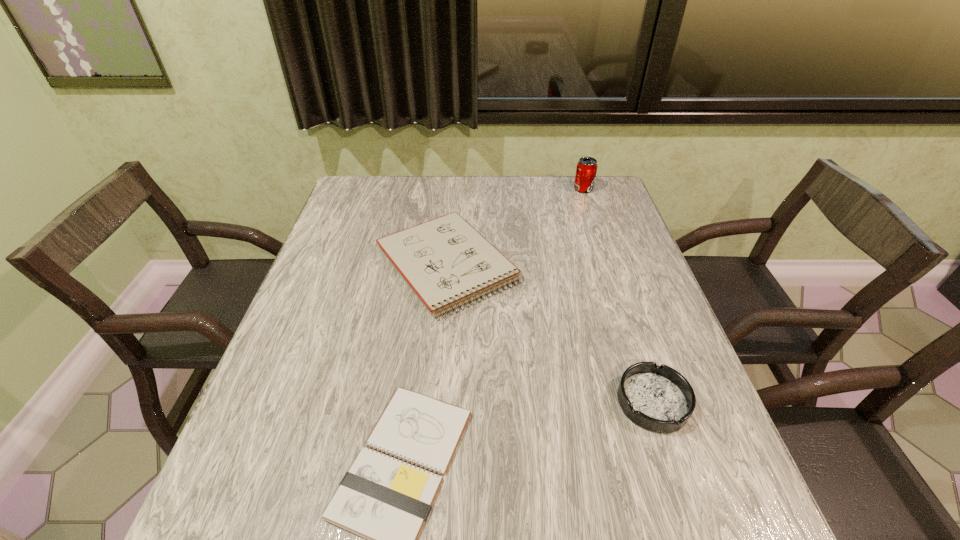
I want to click on soda can located at the right edge, so click(x=586, y=170).

This screenshot has width=960, height=540. In order to click on ashtray that is at the right edge in this screenshot , I will do `click(659, 399)`.

You are a GUI agent. You are given a task and a screenshot of the screen. Output one action in this format:
    pyautogui.click(x=<x>, y=<y>)
    Task: Click on the object located in the far right corner section of the desktop
    
    Given the screenshot: What is the action you would take?
    [x=586, y=170]

Find the location of a particular element. free region at the far edge is located at coordinates (560, 180).

At what (x,y) coordinates should I click in order to perform the action: click on free location at the left edge of the desktop. Please return your answer as a coordinate pair (x, y). Looking at the image, I should click on (331, 306).

In the image, there is a desktop. Where is `vacant space at the right edge`? The width and height of the screenshot is (960, 540). vacant space at the right edge is located at coordinates (703, 419).

Locate an element on the screen. blank area at the far left corner is located at coordinates (350, 202).

You are a GUI agent. You are given a task and a screenshot of the screen. Output one action in this format:
    pyautogui.click(x=<x>, y=<y>)
    Task: Click on the vacant space at the far right corner of the desktop
    
    Given the screenshot: What is the action you would take?
    pyautogui.click(x=576, y=211)

Locate an element on the screen. The width and height of the screenshot is (960, 540). free spot at the near right corner of the desktop is located at coordinates (660, 512).

At what (x,y) coordinates should I click in order to perform the action: click on vacant space that's between the farthest object and the ashtray. Please return your answer as a coordinate pair (x, y). The width and height of the screenshot is (960, 540). Looking at the image, I should click on (618, 295).